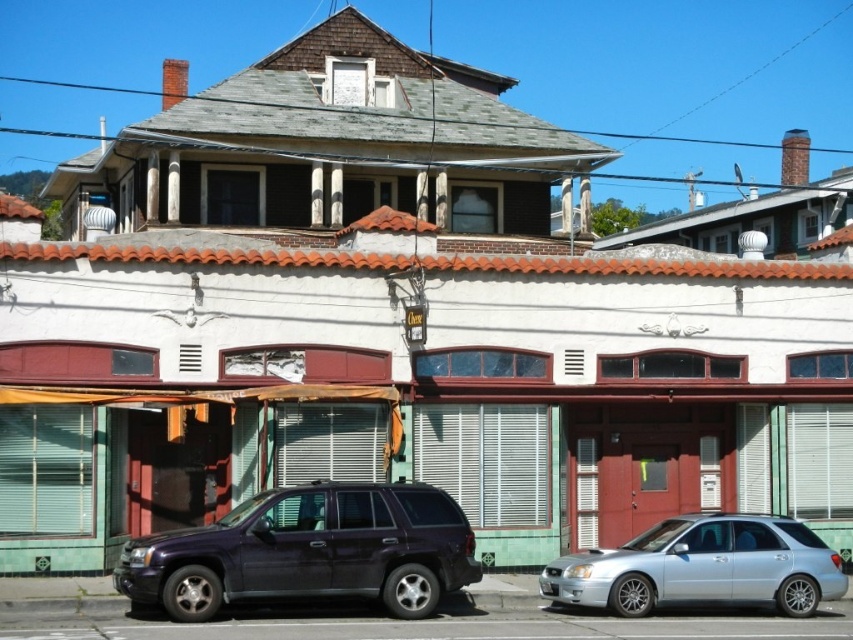
Question: Among these objects, which one is farthest from the camera?

Choices:
 (A) silver metallic sedan at lower right
 (B) glossy dark blue suv at center

Answer: (A)

Question: Does glossy dark blue suv at center appear over silver metallic sedan at lower right?

Choices:
 (A) yes
 (B) no

Answer: (A)

Question: Is glossy dark blue suv at center smaller than silver metallic sedan at lower right?

Choices:
 (A) no
 (B) yes

Answer: (A)

Question: Which point is farther from the camera taking this photo?

Choices:
 (A) (786, 611)
 (B) (357, 513)

Answer: (A)

Question: Among these points, which one is nearest to the camera?

Choices:
 (A) (646, 577)
 (B) (401, 522)

Answer: (B)

Question: Can you confirm if glossy dark blue suv at center is bigger than silver metallic sedan at lower right?

Choices:
 (A) yes
 (B) no

Answer: (A)